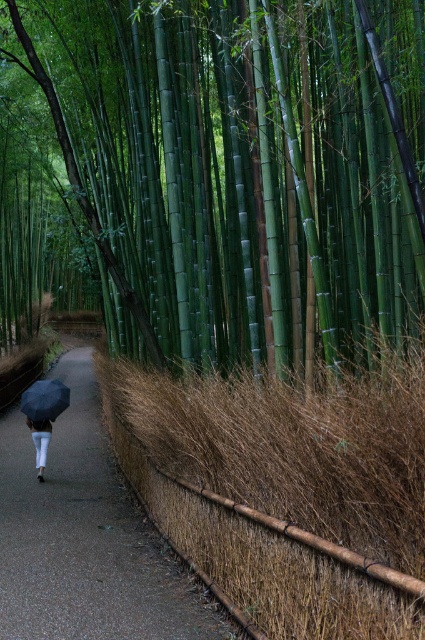
You are standing at the starting point of the pathway and see two points marked on the ground ahead of you. Which point is closer to you? The two points are located at coordinates point (42, 392) and point (36, 448).

Point (42, 392) is in front of point (36, 448), so it is closer to you.

You are standing at the entrance of the bamboo path and notice a person walking away holding a matte black umbrella at lower left and wearing white matte pants at lower left. Which object is wider when viewed from your perspective?

The matte black umbrella at lower left is wider than the white matte pants at lower left according to the description.